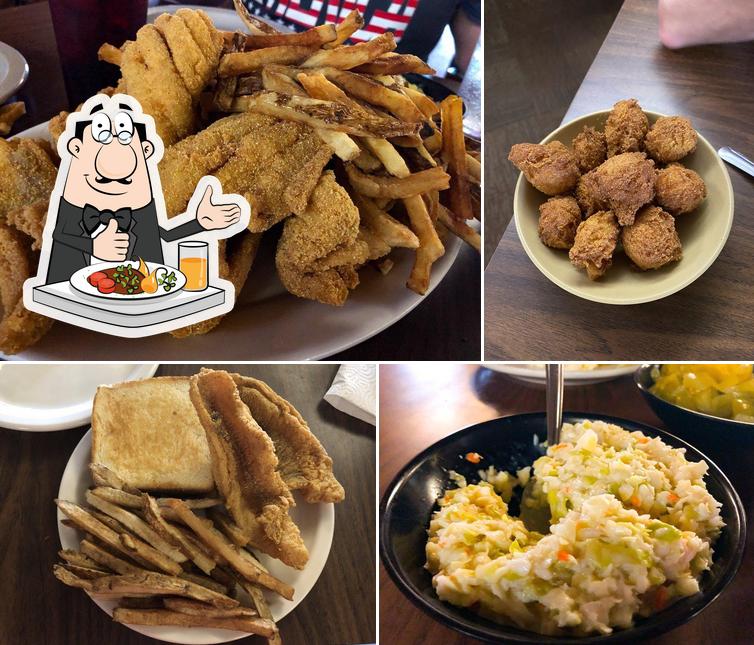
This screenshot has width=754, height=645. What are the coordinates of `napkin` in the screenshot? It's located at (348, 377).